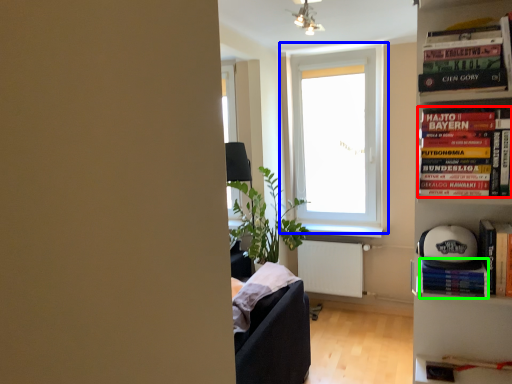
Question: Which is nearer to the book (highlighted by a red box)? window (highlighted by a blue box) or paperback book (highlighted by a green box).

Choices:
 (A) window
 (B) paperback book

Answer: (B)